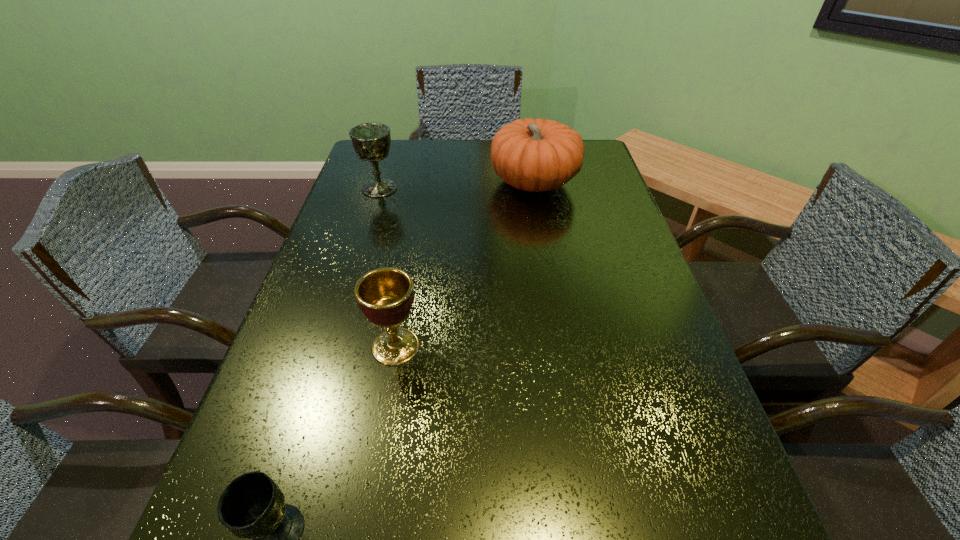
Find the location of a particular element. object that stands as the second closest to the shortest chalice is located at coordinates (371, 141).

Choose which chalice is the second nearest neighbor to the farthest chalice. Please provide its 2D coordinates. Your answer should be formatted as a tuple, i.e. [(x, y)], where the tuple contains the x and y coordinates of a point satisfying the conditions above.

[(252, 506)]

I want to click on chalice that is the second closest to the second nearest object, so click(371, 141).